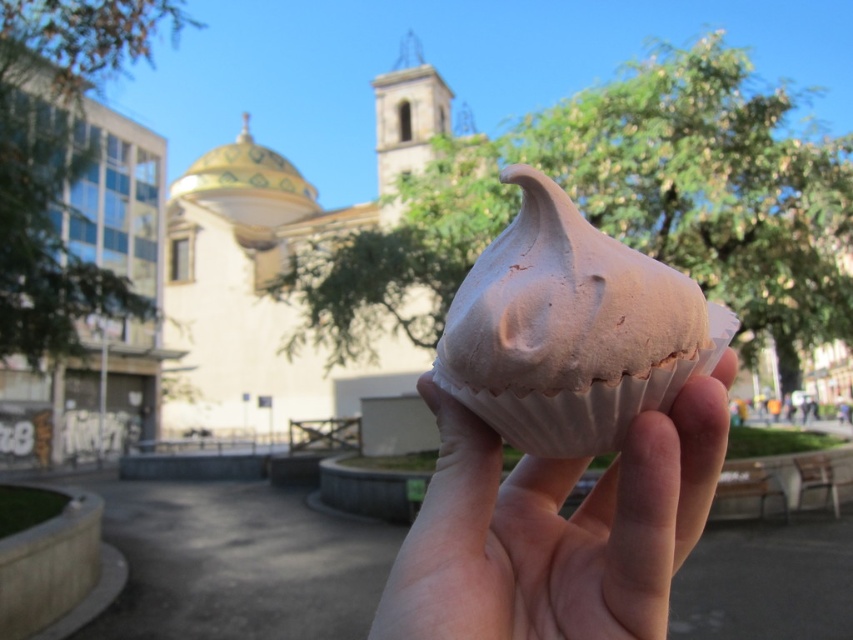
You are standing in the outdoor scene and want to take a photo of the beige stone church at center. If you move 0.1 units to the right along the x axis, will the church still be in the frame?

The beige stone church at center is located at point (288, 276). Moving 0.1 units to the right along the x axis would bring the new x coordinate to 0.533. Since the church is at 0.433, it will still be within the frame as the center point is still within the image bounds.

You are a tourist holding a chocolate matte muffin at center and looking at the beige stone church at center. Which object is larger in size?

The beige stone church at center is bigger than the chocolate matte muffin at center.

You are planning to take a photo of the beige stone church at center and the white paper cupcake at center from a distance. Which object will appear taller in the photo?

The beige stone church at center will appear taller in the photo because it has a greater height compared to the white paper cupcake at center.